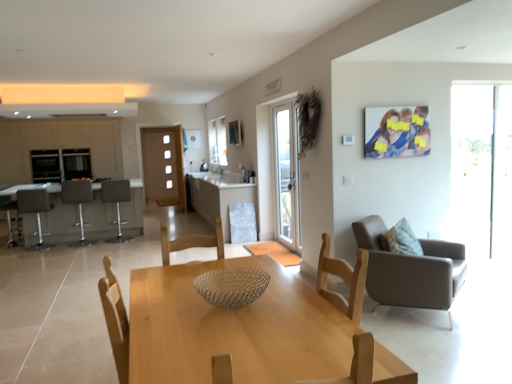
Identify the location of free space above matte plastic photo frame at upper right (from a real-world perspective). The image size is (512, 384). (397, 105).